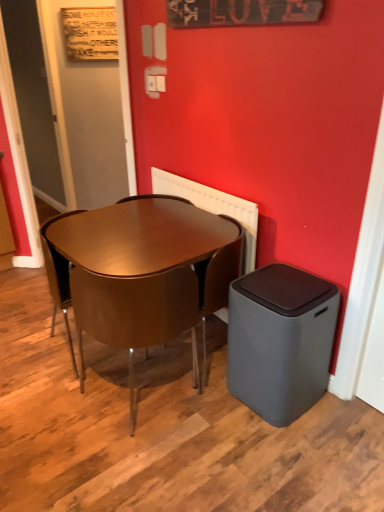
What is the approximate width of white plastic radiator at upper center?

white plastic radiator at upper center is 2.17 inches in width.

The image size is (384, 512). What do you see at coordinates (89, 113) in the screenshot?
I see `matte gray door at upper left, the 2th door in the left-to-right sequence` at bounding box center [89, 113].

Where is `matte gray door at upper left, the 2th door in the left-to-right sequence`? matte gray door at upper left, the 2th door in the left-to-right sequence is located at coordinates (89, 113).

Locate an element on the screen. brown glossy chair at center, which is counted as the third chair, starting from the left is located at coordinates (200, 273).

Describe the element at coordinates (35, 98) in the screenshot. I see `matte gray door at upper left, which is the 2th door in right-to-left order` at that location.

Describe the element at coordinates (241, 12) in the screenshot. This screenshot has height=512, width=384. I see `wooden signboard at upper center, the 2th bulletin board when ordered from left to right` at that location.

Where is `white plastic radiator at upper center`? The height and width of the screenshot is (512, 384). white plastic radiator at upper center is located at coordinates (213, 206).

In the scene shown: Is wooden signboard at upper left, the second bulletin board when ordered from front to back, not within matte gray door at upper left, the 2th door in the left-to-right sequence?

Yes, wooden signboard at upper left, the second bulletin board when ordered from front to back, is located beyond the bounds of matte gray door at upper left, the 2th door in the left-to-right sequence.

From the image's perspective, between wooden signboard at upper left, arranged as the 2th bulletin board when ordered from the bottom, and matte gray door at upper left, the 2th door in the left-to-right sequence, who is located below?

matte gray door at upper left, the 2th door in the left-to-right sequence, from the image's perspective.

From the picture: Which of these two, wooden signboard at upper left, positioned as the 1th bulletin board in back-to-front order, or matte gray door at upper left, the 1th door positioned from the right, stands taller?

Standing taller between the two is matte gray door at upper left, the 1th door positioned from the right.

How different are the orientations of brown glossy chair at center, which is counted as the third chair, starting from the left, and glossy brown chair at center, which is counted as the 1th chair, starting from the left, in degrees?

There is a 180-degree angle between the facing directions of brown glossy chair at center, which is counted as the third chair, starting from the left, and glossy brown chair at center, which is counted as the 1th chair, starting from the left.

Is brown glossy chair at center, which is counted as the third chair, starting from the left, positioned beyond the bounds of glossy brown chair at center, which is counted as the 1th chair, starting from the left?

Yes, brown glossy chair at center, which is counted as the third chair, starting from the left, is located beyond the bounds of glossy brown chair at center, which is counted as the 1th chair, starting from the left.

Is brown glossy chair at center, which is counted as the third chair, starting from the left, next to glossy brown chair at center, marked as the third chair in a right-to-left arrangement, and touching it?

There is a gap between brown glossy chair at center, which is counted as the third chair, starting from the left, and glossy brown chair at center, marked as the third chair in a right-to-left arrangement.

From the picture: From a real-world perspective, is brown glossy chair at center, acting as the 1th chair starting from the right, positioned above or below glossy brown chair at center, marked as the third chair in a right-to-left arrangement?

In terms of real-world spatial position, brown glossy chair at center, acting as the 1th chair starting from the right, is below glossy brown chair at center, marked as the third chair in a right-to-left arrangement.

Who is smaller, wooden signboard at upper left, arranged as the 2th bulletin board when ordered from the bottom, or white plastic radiator at upper center?

wooden signboard at upper left, arranged as the 2th bulletin board when ordered from the bottom, is smaller.

From the image's perspective, is wooden signboard at upper left, positioned as the 1th bulletin board in back-to-front order, over white plastic radiator at upper center?

Yes, from the image's perspective, wooden signboard at upper left, positioned as the 1th bulletin board in back-to-front order, is above white plastic radiator at upper center.

Based on the photo, considering the positions of objects wooden signboard at upper left, the second bulletin board when ordered from front to back, and white plastic radiator at upper center in the image provided, who is more to the left, wooden signboard at upper left, the second bulletin board when ordered from front to back, or white plastic radiator at upper center?

wooden signboard at upper left, the second bulletin board when ordered from front to back, is more to the left.

Does point (107, 14) lie behind point (243, 227)?

Yes, it is behind point (243, 227).

In the image, is brown leather chair at center, which is the 2th chair in left-to-right order, positioned in front of or behind matte gray door at upper left, placed as the first door when sorted from left to right?

brown leather chair at center, which is the 2th chair in left-to-right order, is positioned closer to the viewer than matte gray door at upper left, placed as the first door when sorted from left to right.

Consider the image. Is brown leather chair at center, which is the 2th chair in left-to-right order, next to matte gray door at upper left, placed as the first door when sorted from left to right?

brown leather chair at center, which is the 2th chair in left-to-right order, and matte gray door at upper left, placed as the first door when sorted from left to right, are clearly separated.

What's the angular difference between brown leather chair at center, marked as the 2th chair in a right-to-left arrangement, and matte gray door at upper left, which is the 2th door in right-to-left order,'s facing directions?

42.5 degrees separate the facing orientations of brown leather chair at center, marked as the 2th chair in a right-to-left arrangement, and matte gray door at upper left, which is the 2th door in right-to-left order.

Is brown leather chair at center, marked as the 2th chair in a right-to-left arrangement, aimed at matte gray door at upper left, placed as the first door when sorted from left to right?

No, brown leather chair at center, marked as the 2th chair in a right-to-left arrangement, is not turned towards matte gray door at upper left, placed as the first door when sorted from left to right.

Is glossy brown chair at center, marked as the third chair in a right-to-left arrangement, at the back of brown leather chair at center, marked as the 2th chair in a right-to-left arrangement?

No, brown leather chair at center, marked as the 2th chair in a right-to-left arrangement, is not facing the opposite direction of glossy brown chair at center, marked as the third chair in a right-to-left arrangement.

What's the angular difference between brown leather chair at center, marked as the 2th chair in a right-to-left arrangement, and glossy brown chair at center, which is counted as the 1th chair, starting from the left,'s facing directions?

The angle between the facing direction of brown leather chair at center, marked as the 2th chair in a right-to-left arrangement, and the facing direction of glossy brown chair at center, which is counted as the 1th chair, starting from the left, is 0.00119 degrees.

Is point (117, 339) less distant than point (52, 318)?

Yes, point (117, 339) is closer to viewer.

Is brown leather chair at center, marked as the 2th chair in a right-to-left arrangement, in contact with glossy brown chair at center, which is counted as the 1th chair, starting from the left?

No, brown leather chair at center, marked as the 2th chair in a right-to-left arrangement, is not next to glossy brown chair at center, which is counted as the 1th chair, starting from the left.

Considering the relative sizes of brown leather chair at center, marked as the 2th chair in a right-to-left arrangement, and wooden signboard at upper left, acting as the 2th bulletin board starting from the right, in the image provided, is brown leather chair at center, marked as the 2th chair in a right-to-left arrangement, bigger than wooden signboard at upper left, acting as the 2th bulletin board starting from the right,?

Yes, brown leather chair at center, marked as the 2th chair in a right-to-left arrangement, is bigger than wooden signboard at upper left, acting as the 2th bulletin board starting from the right.

How much distance is there between brown leather chair at center, which is the 2th chair in left-to-right order, and wooden signboard at upper left, arranged as the 2th bulletin board when ordered from the bottom?

brown leather chair at center, which is the 2th chair in left-to-right order, is 8.50 feet away from wooden signboard at upper left, arranged as the 2th bulletin board when ordered from the bottom.

Is brown leather chair at center, marked as the 2th chair in a right-to-left arrangement, in contact with wooden signboard at upper left, positioned as the 1th bulletin board in back-to-front order?

brown leather chair at center, marked as the 2th chair in a right-to-left arrangement, and wooden signboard at upper left, positioned as the 1th bulletin board in back-to-front order, are clearly separated.

Considering the relative sizes of brown leather chair at center, which is the 2th chair in left-to-right order, and wooden signboard at upper left, positioned as the 1th bulletin board in left-to-right order, in the image provided, is brown leather chair at center, which is the 2th chair in left-to-right order, taller than wooden signboard at upper left, positioned as the 1th bulletin board in left-to-right order,?

Indeed, brown leather chair at center, which is the 2th chair in left-to-right order, has a greater height compared to wooden signboard at upper left, positioned as the 1th bulletin board in left-to-right order.

Is white plastic radiator at upper center surrounded by wooden signboard at upper center, which ranks as the 2th bulletin board in back-to-front order?

No.

Is point (181, 4) more distant than point (254, 234)?

Yes, it is.

Does wooden signboard at upper center, the 2th bulletin board when ordered from left to right, have a lesser width compared to white plastic radiator at upper center?

Yes.

Is wooden signboard at upper center, the first bulletin board viewed from the right, far away from white plastic radiator at upper center?

No, wooden signboard at upper center, the first bulletin board viewed from the right, is in close proximity to white plastic radiator at upper center.

There is a wooden signboard at upper left, acting as the 2th bulletin board starting from the right. Identify the location of the 1st door below it (from a real-world perspective). (89, 113).

Starting from the glossy brown chair at center, marked as the third chair in a right-to-left arrangement, which chair is the 2nd one to the right? Please provide its 2D coordinates.

[(200, 273)]

Looking at the image, which one is located closer to glossy brown chair at center, marked as the third chair in a right-to-left arrangement, gray matte trash bin at lower right or wooden signboard at upper center, the first bulletin board viewed from the right?

Among the two, gray matte trash bin at lower right is located nearer to glossy brown chair at center, marked as the third chair in a right-to-left arrangement.

Based on their spatial positions, is brown glossy chair at center, which is counted as the third chair, starting from the left, or glossy brown chair at center, marked as the third chair in a right-to-left arrangement, further from gray matte trash bin at lower right?

Based on the image, glossy brown chair at center, marked as the third chair in a right-to-left arrangement, appears to be further to gray matte trash bin at lower right.

Based on their spatial positions, is white plastic radiator at upper center or wooden signboard at upper center, which ranks as the 2th bulletin board in back-to-front order, further from brown leather chair at center, marked as the 2th chair in a right-to-left arrangement?

wooden signboard at upper center, which ranks as the 2th bulletin board in back-to-front order, is further to brown leather chair at center, marked as the 2th chair in a right-to-left arrangement.

Estimate the real-world distances between objects in this image. Which object is closer to wooden signboard at upper left, positioned as the 1th bulletin board in left-to-right order, matte gray door at upper left, the 2th door in the left-to-right sequence, or glossy brown chair at center, which is counted as the 1th chair, starting from the left?

Among the two, matte gray door at upper left, the 2th door in the left-to-right sequence, is located nearer to wooden signboard at upper left, positioned as the 1th bulletin board in left-to-right order.

From the image, which object appears to be nearer to matte gray door at upper left, placed as the first door when sorted from left to right, matte brown table at center or brown glossy chair at center, which is counted as the third chair, starting from the left?

matte brown table at center is positioned closer to the anchor matte gray door at upper left, placed as the first door when sorted from left to right.

When comparing their distances from brown glossy chair at center, acting as the 1th chair starting from the right, does matte gray door at upper left, the 2th door in the left-to-right sequence, or wooden signboard at upper left, marked as the 1th bulletin board in a top-to-bottom arrangement, seem further?

The object further to brown glossy chair at center, acting as the 1th chair starting from the right, is matte gray door at upper left, the 2th door in the left-to-right sequence.

Based on their spatial positions, is glossy brown chair at center, marked as the third chair in a right-to-left arrangement, or white plastic radiator at upper center closer to brown glossy chair at center, which is counted as the third chair, starting from the left?

The object closer to brown glossy chair at center, which is counted as the third chair, starting from the left, is white plastic radiator at upper center.

From the image, which object appears to be nearer to brown leather chair at center, which is the 2th chair in left-to-right order, matte brown table at center or wooden signboard at upper center, the 1th bulletin board when ordered from bottom to top?

matte brown table at center.

At what (x,y) coordinates should I click in order to perform the action: click on chair situated between matte brown table at center and gray matte trash bin at lower right from left to right. Please return your answer as a coordinate pair (x, y). Looking at the image, I should click on (200, 273).

The height and width of the screenshot is (512, 384). Find the location of `radiator situated between matte gray door at upper left, which is the 2th door in right-to-left order, and brown glossy chair at center, acting as the 1th chair starting from the right, from left to right`. radiator situated between matte gray door at upper left, which is the 2th door in right-to-left order, and brown glossy chair at center, acting as the 1th chair starting from the right, from left to right is located at coordinates (213, 206).

The height and width of the screenshot is (512, 384). In order to click on desk located between glossy brown chair at center, marked as the third chair in a right-to-left arrangement, and gray matte trash bin at lower right in the left-right direction in this screenshot , I will do `click(140, 236)`.

Find the location of a particular element. This screenshot has width=384, height=512. desk between matte gray door at upper left, which is the 2th door in right-to-left order, and brown glossy chair at center, acting as the 1th chair starting from the right, vertically is located at coordinates (140, 236).